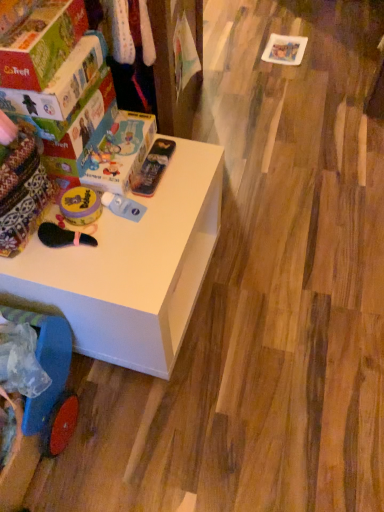
Question: In terms of width, does matte cardboard box at upper left, the 2th box positioned from the back, look wider or thinner when compared to white matte table at upper left?

Choices:
 (A) wide
 (B) thin

Answer: (B)

Question: From the image's perspective, relative to white matte table at upper left, is matte cardboard box at upper left, which is counted as the first box, starting from the front, above or below?

Choices:
 (A) above
 (B) below

Answer: (A)

Question: Which of these objects is positioned farthest from the yellow matte container at left, arranged as the third toy when viewed from the right?

Choices:
 (A) blue plastic baby carriage at lower left
 (B) metallic blue pencil case at upper center, the third toy from the left
 (C) matte cardboard box at upper left, which is counted as the first box, starting from the front
 (D) matte cardboard box at upper left, the first box from the back
 (E) yellow matte bubble container at center, which is the 2th toy in right-to-left order

Answer: (A)

Question: Estimate the real-world distances between objects in this image. Which object is farther from the matte cardboard box at upper left, the first box from the back?

Choices:
 (A) blue plastic baby carriage at lower left
 (B) yellow matte container at left, arranged as the third toy when viewed from the right
 (C) white matte table at upper left
 (D) metallic blue pencil case at upper center, which is the 1th toy in right-to-left order
 (E) matte cardboard box at upper left, the 2th box positioned from the back

Answer: (A)